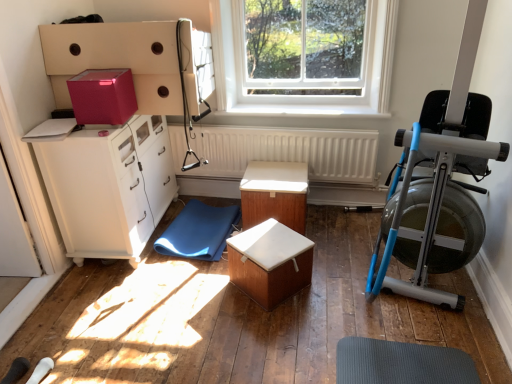
The width and height of the screenshot is (512, 384). I want to click on vacant space situated above white smooth window sill at center (from a real-world perspective), so click(x=298, y=108).